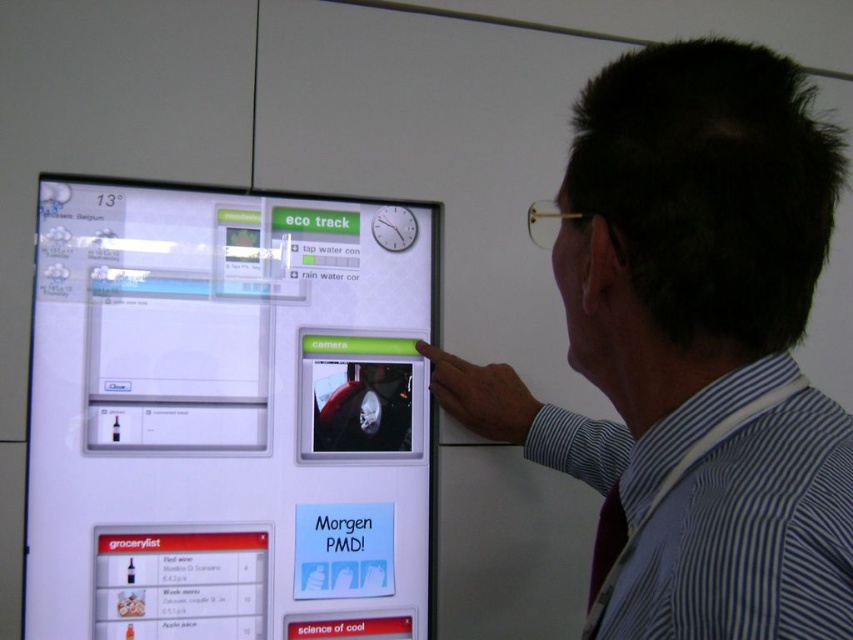
Identify the location of transparent glass screen at upper left. (228, 413).

Does transparent glass screen at upper left appear on the left side of striped shirt at upper right?

Indeed, transparent glass screen at upper left is positioned on the left side of striped shirt at upper right.

Where is `transparent glass screen at upper left`? The height and width of the screenshot is (640, 853). transparent glass screen at upper left is located at coordinates (228, 413).

Where is `transparent glass screen at upper left`? transparent glass screen at upper left is located at coordinates (228, 413).